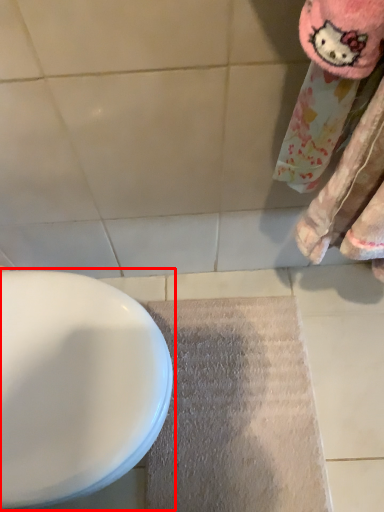
Question: From the image's perspective, considering the relative positions of toilet (annotated by the red box) and doormat in the image provided, where is toilet (annotated by the red box) located with respect to the staircase?

Choices:
 (A) below
 (B) above

Answer: (B)